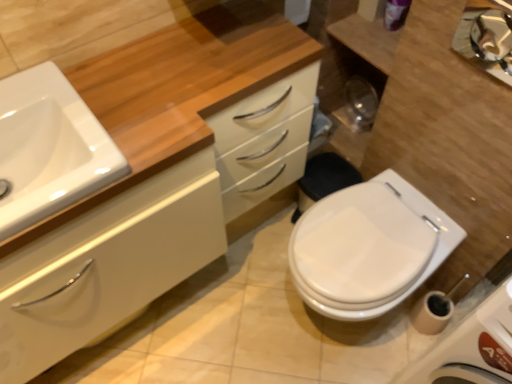
Question: From a real-world perspective, is white glossy sink at left above or below metallic reflective mirror at upper right?

Choices:
 (A) below
 (B) above

Answer: (A)

Question: Is white glossy sink at left wider or thinner than metallic reflective mirror at upper right?

Choices:
 (A) wide
 (B) thin

Answer: (A)

Question: Which object is positioned closest to the white glossy cabinet at center?

Choices:
 (A) white glossy toilet at lower right
 (B) white glossy sink at left
 (C) white glossy toilet at lower right
 (D) metallic reflective mirror at upper right

Answer: (B)

Question: Based on their relative distances, which object is nearer to the metallic reflective mirror at upper right?

Choices:
 (A) white glossy sink at left
 (B) white glossy cabinet at center
 (C) white glossy toilet at lower right
 (D) white glossy toilet at lower right

Answer: (C)